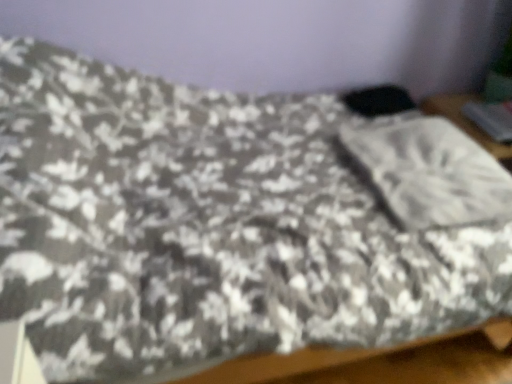
Question: From the image's perspective, is white textured pillow at center under metallic gray laptop at upper right?

Choices:
 (A) yes
 (B) no

Answer: (A)

Question: Does white textured pillow at center have a lesser width compared to metallic gray laptop at upper right?

Choices:
 (A) no
 (B) yes

Answer: (A)

Question: Does white textured pillow at center have a larger size compared to metallic gray laptop at upper right?

Choices:
 (A) yes
 (B) no

Answer: (A)

Question: From a real-world perspective, is white textured pillow at center positioned under metallic gray laptop at upper right based on gravity?

Choices:
 (A) yes
 (B) no

Answer: (B)

Question: From the image's perspective, is white textured pillow at center located above metallic gray laptop at upper right?

Choices:
 (A) yes
 (B) no

Answer: (B)

Question: Can you confirm if white textured pillow at center is positioned to the right of metallic gray laptop at upper right?

Choices:
 (A) yes
 (B) no

Answer: (B)

Question: Could you tell me if metallic gray laptop at upper right is turned towards white textured pillow at center?

Choices:
 (A) no
 (B) yes

Answer: (A)

Question: Can you confirm if metallic gray laptop at upper right is taller than white textured pillow at center?

Choices:
 (A) no
 (B) yes

Answer: (A)

Question: Does metallic gray laptop at upper right appear on the right side of white textured pillow at center?

Choices:
 (A) yes
 (B) no

Answer: (A)

Question: Does metallic gray laptop at upper right touch white textured pillow at center?

Choices:
 (A) no
 (B) yes

Answer: (A)

Question: Is metallic gray laptop at upper right wider than white textured pillow at center?

Choices:
 (A) no
 (B) yes

Answer: (A)

Question: From a real-world perspective, is metallic gray laptop at upper right below white textured pillow at center?

Choices:
 (A) no
 (B) yes

Answer: (B)

Question: Do you think metallic gray laptop at upper right is within white textured pillow at center, or outside of it?

Choices:
 (A) outside
 (B) inside

Answer: (A)